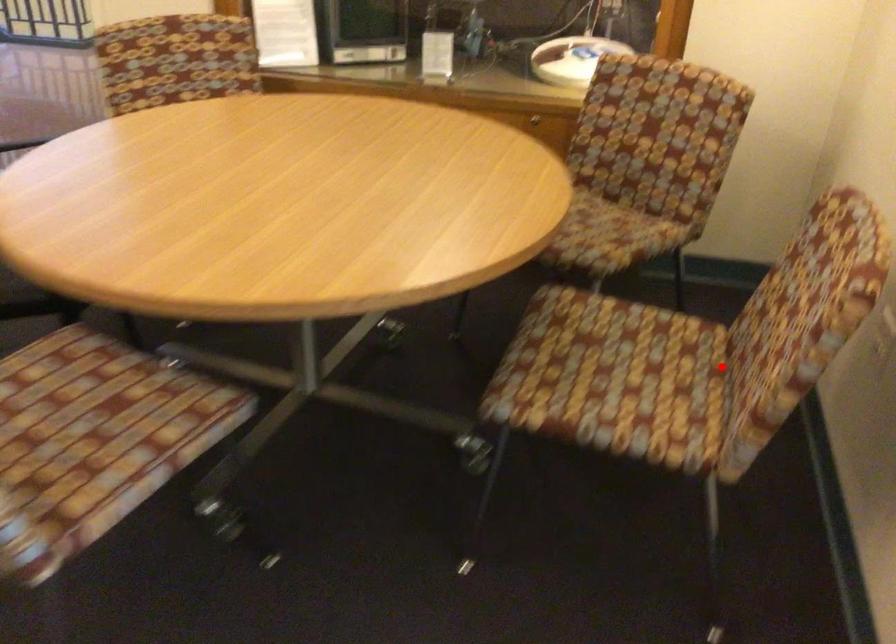
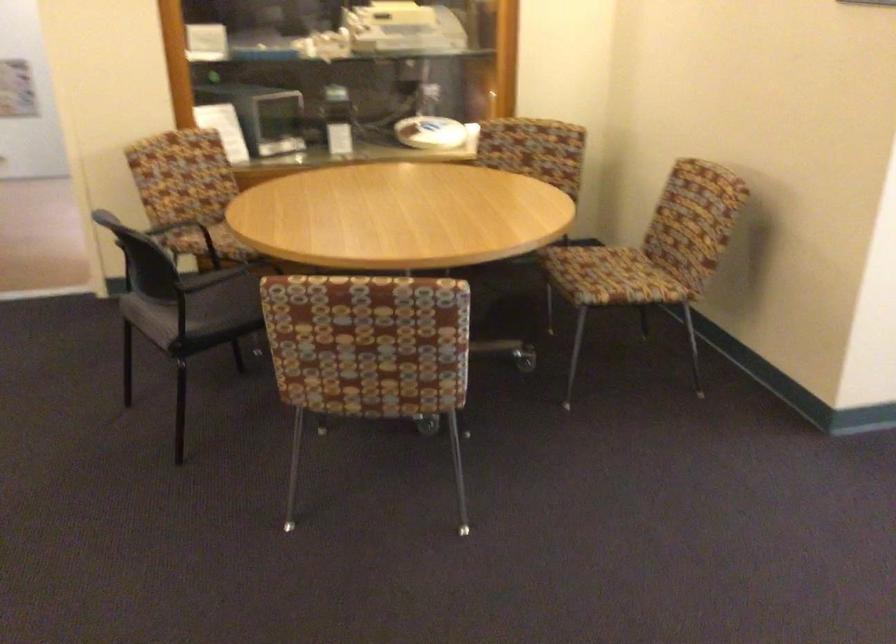
Locate, in the second image, the point that corresponds to the highlighted location in the first image.

(652, 254)